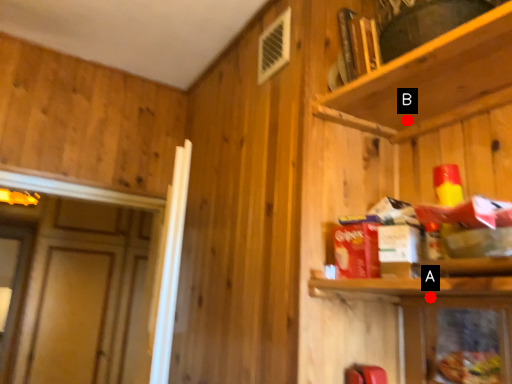
Question: Two points are circled on the image, labeled by A and B beside each circle. Among these points, which one is nearest to the camera?

Choices:
 (A) A is closer
 (B) B is closer

Answer: (A)